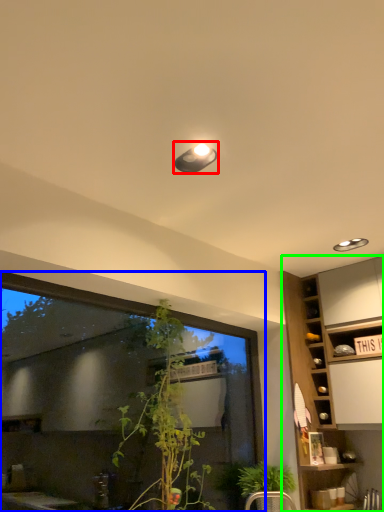
Question: Which object is the closest to the light fixture (highlighted by a red box)? Choose among these: window (highlighted by a blue box) or cabinetry (highlighted by a green box).

Choices:
 (A) window
 (B) cabinetry

Answer: (A)